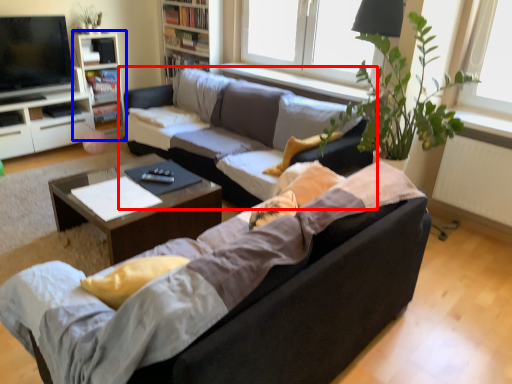
Question: Which object appears farthest to the camera in this image, studio couch (highlighted by a red box) or bookshelf (highlighted by a blue box)?

Choices:
 (A) studio couch
 (B) bookshelf

Answer: (B)